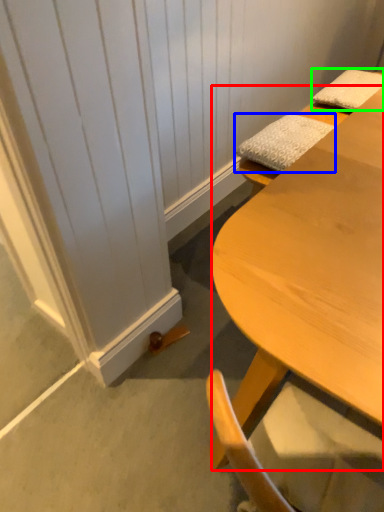
Question: Based on their relative distances, which object is nearer to desk (highlighted by a red box)? Choose from pillow (highlighted by a blue box) and pillow (highlighted by a green box).

Choices:
 (A) pillow
 (B) pillow

Answer: (A)